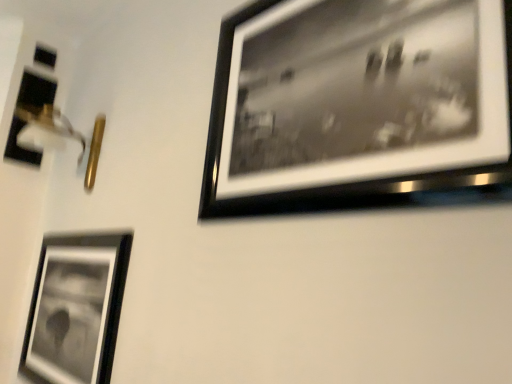
Question: Considering the positions of point (103, 357) and point (40, 61), is point (103, 357) closer or farther from the camera than point (40, 61)?

Choices:
 (A) closer
 (B) farther

Answer: (A)

Question: Considering their positions, is metallic silver frame at lower left, positioned as the second picture frame in right-to-left order, located in front of or behind matte black picture frame at left, positioned as the third picture frame in front-to-back order?

Choices:
 (A) behind
 (B) front

Answer: (B)

Question: Which object is the closest to the black matte picture frame at upper right, the 1th picture frame viewed from the right?

Choices:
 (A) matte black picture frame at left, arranged as the 1th picture frame when viewed from the left
 (B) metallic silver frame at lower left, placed as the second picture frame when sorted from left to right

Answer: (B)

Question: Based on their relative distances, which object is farther from the black matte picture frame at upper right, the 1th picture frame viewed from the right?

Choices:
 (A) matte black picture frame at left, the third picture frame viewed from the right
 (B) metallic silver frame at lower left, placed as the second picture frame when sorted from left to right

Answer: (A)